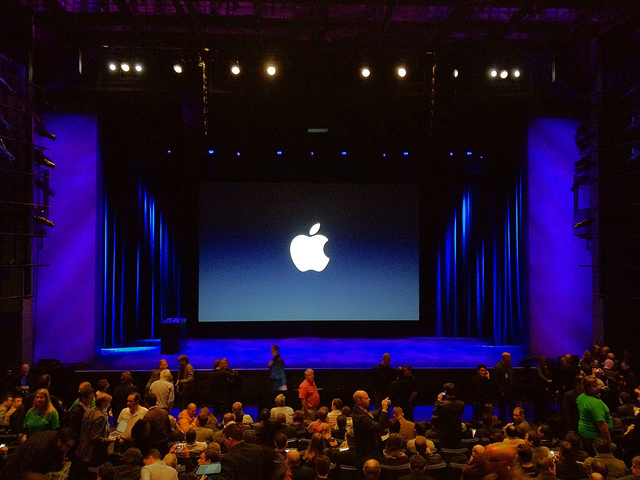
Locate an element on the screen. backdrop is located at coordinates (367, 304).